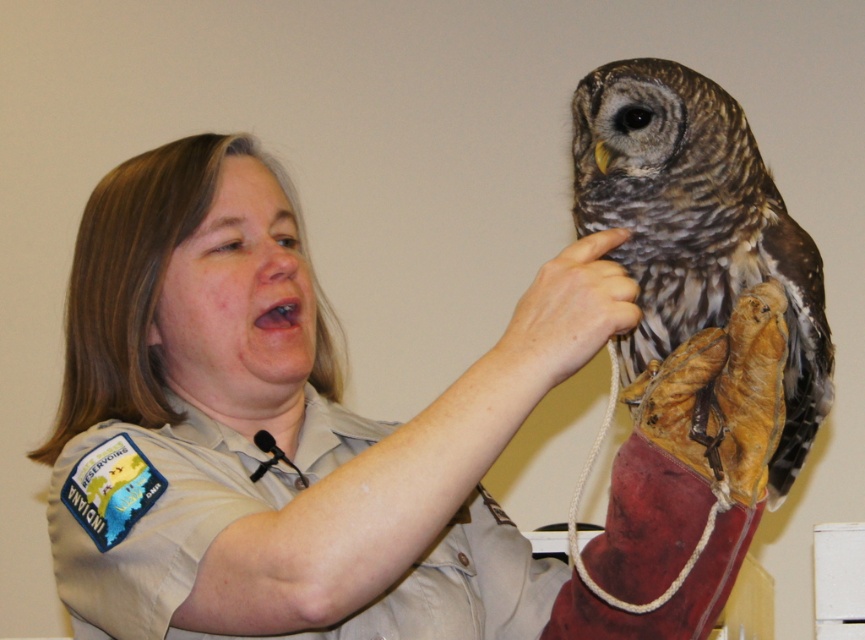
Question: Does light brown uniform at center lie behind brown speckled feathers at upper right?

Choices:
 (A) no
 (B) yes

Answer: (A)

Question: Which of the following is the farthest from the observer?

Choices:
 (A) brown speckled feathers at upper right
 (B) light brown uniform at center
 (C) brown leather glove at upper center

Answer: (A)

Question: Which point appears farthest from the camera in this image?

Choices:
 (A) (585, 316)
 (B) (561, 266)
 (C) (705, 205)

Answer: (C)

Question: Can you confirm if light brown uniform at center is wider than brown leather glove at upper center?

Choices:
 (A) yes
 (B) no

Answer: (A)

Question: Estimate the real-world distances between objects in this image. Which object is farther from the light brown uniform at center?

Choices:
 (A) brown speckled feathers at upper right
 (B) brown leather glove at upper center

Answer: (B)

Question: Is brown speckled feathers at upper right to the left of brown leather glove at upper center from the viewer's perspective?

Choices:
 (A) no
 (B) yes

Answer: (A)